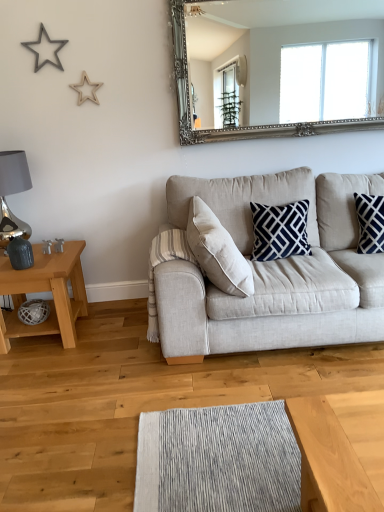
Question: Considering their positions, is beige fabric couch at center located in front of or behind silver ornate mirror at upper center?

Choices:
 (A) front
 (B) behind

Answer: (A)

Question: Visually, is beige fabric couch at center positioned to the left or to the right of silver ornate mirror at upper center?

Choices:
 (A) right
 (B) left

Answer: (A)

Question: Which object is the farthest from the silver metallic lamp at left?

Choices:
 (A) matte wooden table at left
 (B) silver ornate mirror at upper center
 (C) beige fabric couch at center

Answer: (B)

Question: Which object is positioned farthest from the beige fabric couch at center?

Choices:
 (A) silver metallic lamp at left
 (B) matte wooden table at left
 (C) silver ornate mirror at upper center

Answer: (C)